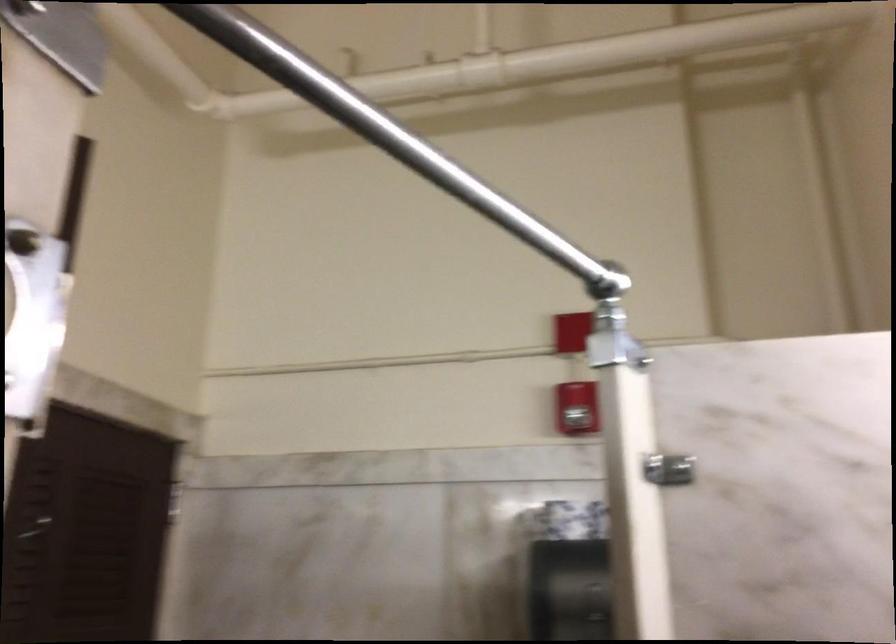
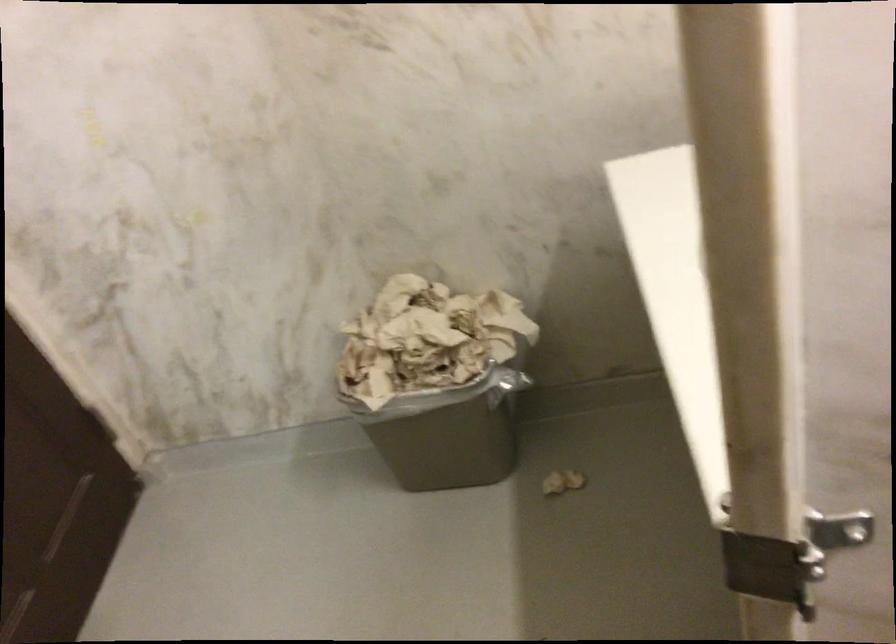
Question: How did the camera likely rotate?

Choices:
 (A) Left
 (B) Right
 (C) Up
 (D) Down

Answer: (D)